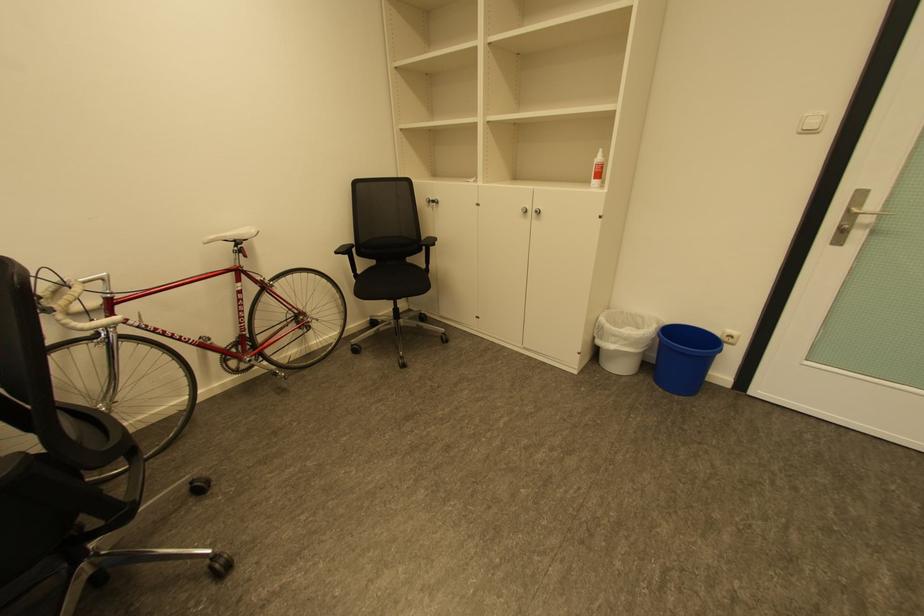
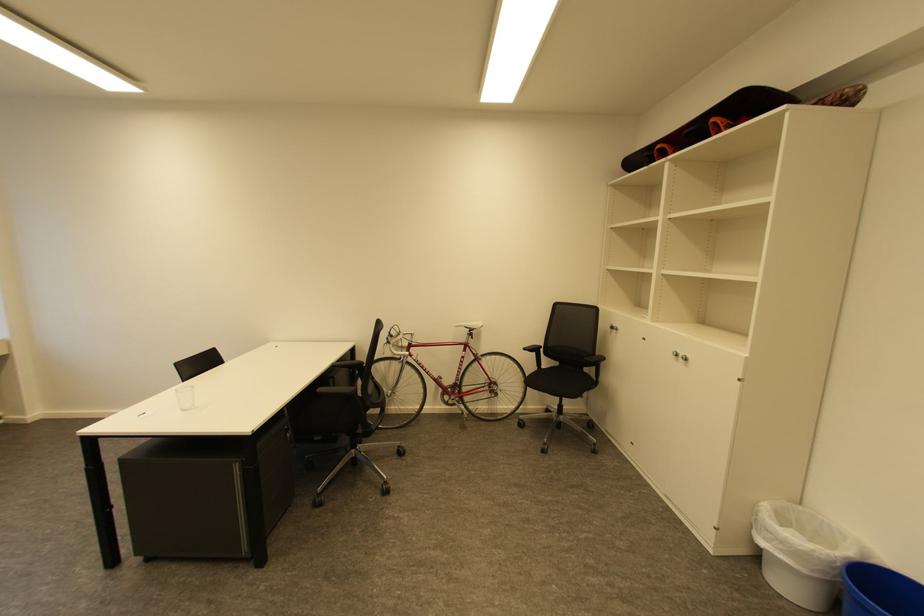
Locate, in the second image, the point that corresponds to point (543, 213) in the first image.

(689, 359)